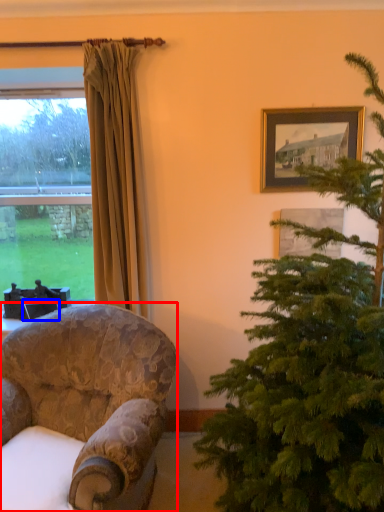
Question: Which object appears farthest to the camera in this image, chair (highlighted by a red box) or picture frame (highlighted by a blue box)?

Choices:
 (A) chair
 (B) picture frame

Answer: (B)